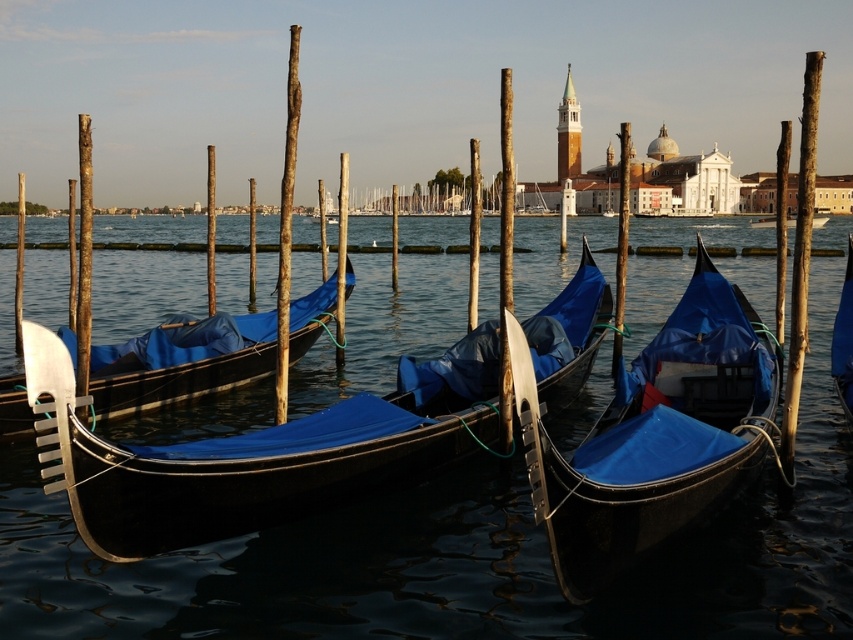
Measure the distance between blue tarp-covered canoe at center and camera.

blue tarp-covered canoe at center and camera are 184.72 feet apart from each other.

Which is above, blue tarp-covered canoe at center or shiny blue canoe at center?

shiny blue canoe at center is above.

Is point (115, 385) farther from camera compared to point (844, 342)?

Yes, it is.

Locate an element on the screen. The height and width of the screenshot is (640, 853). blue tarp-covered canoe at center is located at coordinates (189, 372).

Is point (300, 499) positioned after point (259, 371)?

No, (300, 499) is in front of (259, 371).

Does point (384, 438) come in front of point (334, 296)?

Yes, it is.

Locate an element on the screen. The width and height of the screenshot is (853, 640). shiny black canoe at center is located at coordinates (242, 464).

Which is in front, point (689, 385) or point (80, 308)?

Point (689, 385) is more forward.

Between matte black canoe at center and wooden pole at left, which one has more height?

wooden pole at left is taller.

The width and height of the screenshot is (853, 640). Identify the location of matte black canoe at center. (654, 435).

Identify the location of matte black canoe at center. The image size is (853, 640). (654, 435).